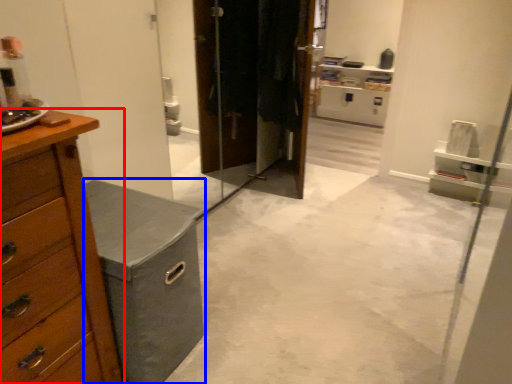
Question: Which object appears farthest to the camera in this image, chest of drawers (highlighted by a red box) or vanity (highlighted by a blue box)?

Choices:
 (A) chest of drawers
 (B) vanity

Answer: (B)